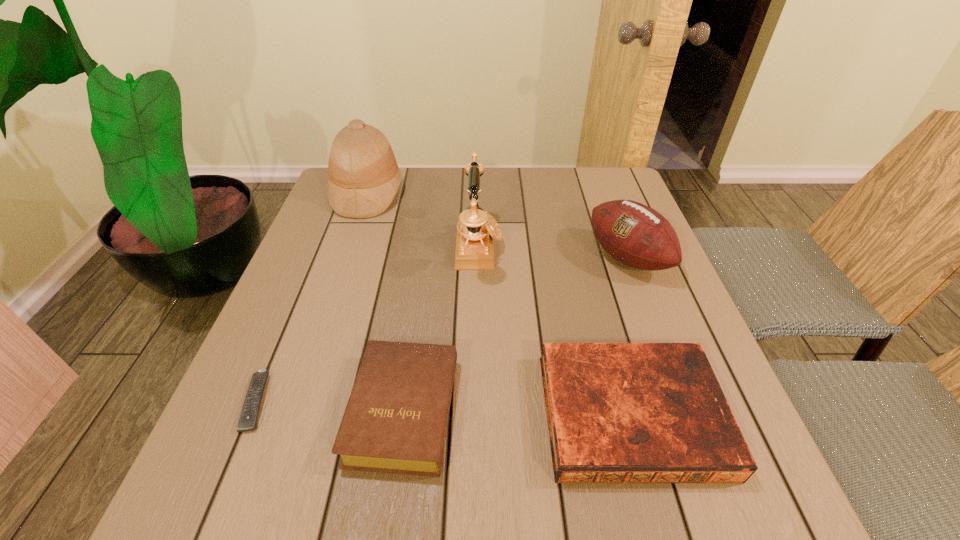
Find the location of `vacant space that is in between the shortest object and the hat`. vacant space that is in between the shortest object and the hat is located at coordinates (312, 297).

The image size is (960, 540). Find the location of `free space between the right Bible and the telephone`. free space between the right Bible and the telephone is located at coordinates (555, 331).

You are a GUI agent. You are given a task and a screenshot of the screen. Output one action in this format:
    pyautogui.click(x=<x>, y=<y>)
    Task: Click on the vacant point located between the left Bible and the telephone
    The height and width of the screenshot is (540, 960).
    Given the screenshot: What is the action you would take?
    pyautogui.click(x=442, y=329)

Find the location of a particular element. This screenshot has height=540, width=960. vacant area that lies between the hat and the telephone is located at coordinates (423, 220).

Find the location of a particular element. free space between the left Bible and the shortest object is located at coordinates (330, 406).

Identify which object is the second nearest to the left Bible. Please provide its 2D coordinates. Your answer should be formatted as a tuple, i.e. [(x, y)], where the tuple contains the x and y coordinates of a point satisfying the conditions above.

[(617, 412)]

Point out which object is positioned as the fourth nearest to the remote control. Please provide its 2D coordinates. Your answer should be formatted as a tuple, i.e. [(x, y)], where the tuple contains the x and y coordinates of a point satisfying the conditions above.

[(617, 412)]

The image size is (960, 540). I want to click on free space that satisfies the following two spatial constraints: 1. on the back side of the football (American); 2. on the front-facing side of the hat, so click(603, 193).

Locate an element on the screen. This screenshot has height=540, width=960. free space that satisfies the following two spatial constraints: 1. on the back side of the left Bible; 2. on the left side of the third tallest object is located at coordinates (425, 258).